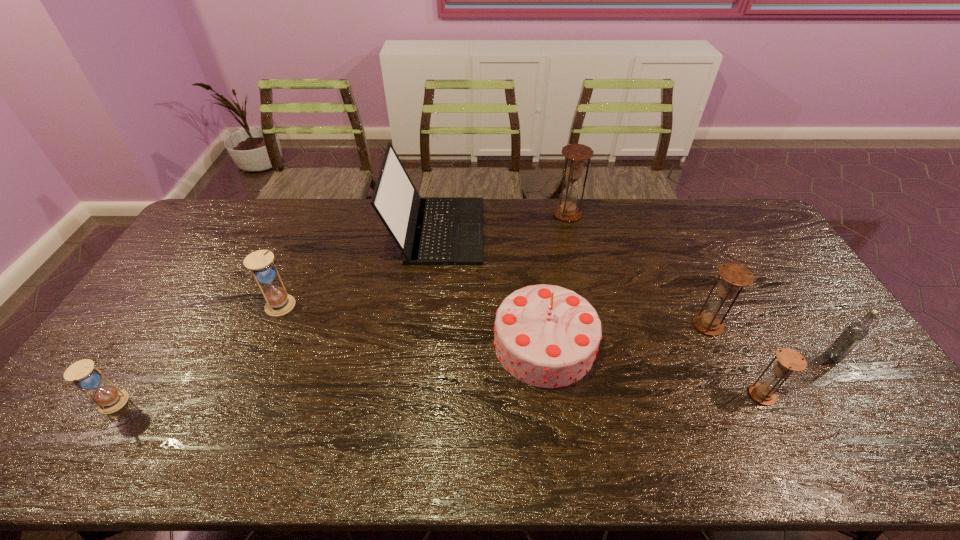
The image size is (960, 540). In order to click on vacant space in between the birthday cake and the second farthest brown hourglass in this screenshot , I will do `click(626, 335)`.

The height and width of the screenshot is (540, 960). What are the coordinates of `vacant point located between the third hourglass from left to right and the second farthest brown hourglass` in the screenshot? It's located at click(637, 269).

Find the location of a particular element. This screenshot has height=540, width=960. free space between the third object from left to right and the farthest brown hourglass is located at coordinates (502, 222).

Locate an element on the screen. The width and height of the screenshot is (960, 540). free spot between the leftmost object and the farther white hourglass is located at coordinates (198, 354).

What are the coordinates of `free point between the rightmost object and the birthday cake` in the screenshot? It's located at (688, 351).

This screenshot has width=960, height=540. I want to click on vacant space that is in between the nearest brown hourglass and the birthday cake, so click(x=653, y=369).

Where is `free spot between the leftmost hourglass and the right white hourglass`? free spot between the leftmost hourglass and the right white hourglass is located at coordinates (198, 354).

You are a GUI agent. You are given a task and a screenshot of the screen. Output one action in this format:
    pyautogui.click(x=<x>, y=<y>)
    Task: Click on the free space between the second biggest brown hourglass and the second hourglass from left to right
    
    Given the screenshot: What is the action you would take?
    click(495, 315)

Locate an element on the screen. The image size is (960, 540). vacant space that's between the laptop and the birthday cake is located at coordinates (491, 287).

Identify the location of object that is the second nearest to the second nearest brown hourglass. (855, 332).